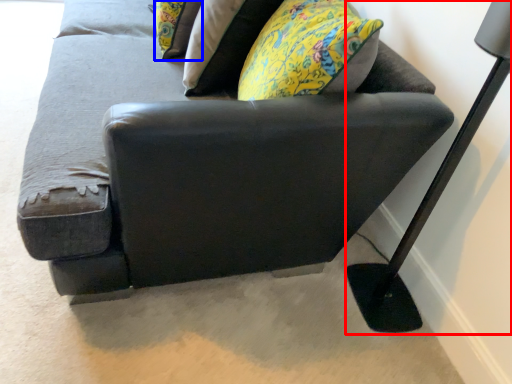
Question: Which object is closer to the camera taking this photo, table lamp (highlighted by a red box) or pillow (highlighted by a blue box)?

Choices:
 (A) table lamp
 (B) pillow

Answer: (A)